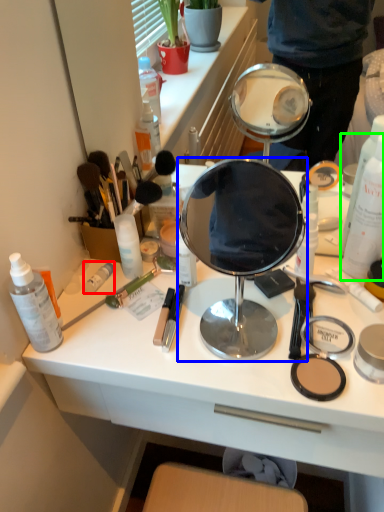
Question: Which object is the closest to the toiletry (highlighted by a red box)? Choose among these: mirror (highlighted by a blue box) or bottle (highlighted by a green box).

Choices:
 (A) mirror
 (B) bottle

Answer: (B)